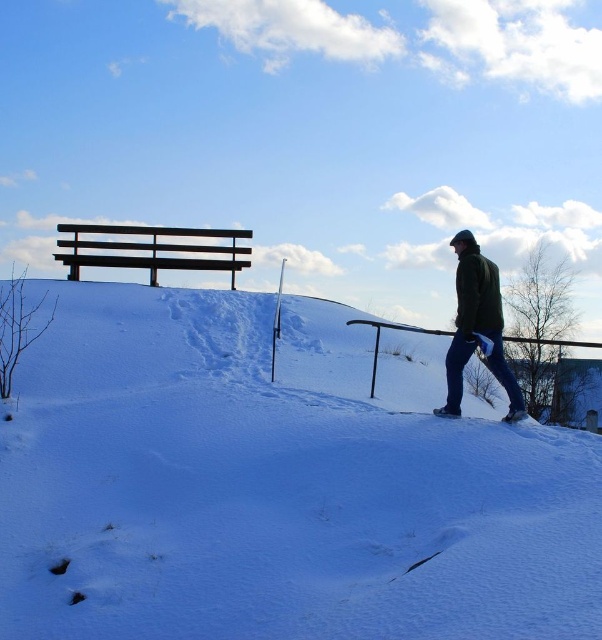
Question: Among these objects, which one is nearest to the camera?

Choices:
 (A) dark brown wooden bench at upper left
 (B) dark green jacket at right

Answer: (B)

Question: Does white powdery snow at lower center appear on the left side of dark brown wooden bench at upper left?

Choices:
 (A) yes
 (B) no

Answer: (B)

Question: Considering the real-world distances, which object is closest to the dark green jacket at right?

Choices:
 (A) dark brown wooden bench at upper left
 (B) white powdery snow at lower center

Answer: (B)

Question: Is dark green jacket at right wider than dark brown wooden bench at upper left?

Choices:
 (A) no
 (B) yes

Answer: (A)

Question: Considering the real-world distances, which object is closest to the white powdery snow at lower center?

Choices:
 (A) dark brown wooden bench at upper left
 (B) dark green jacket at right

Answer: (B)

Question: Is dark green jacket at right positioned in front of dark brown wooden bench at upper left?

Choices:
 (A) yes
 (B) no

Answer: (A)